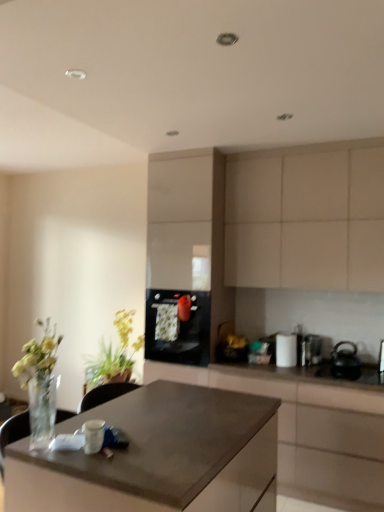
Where is `white glossy canister at upper right, which appears as the first appliance when viewed from the left`? This screenshot has height=512, width=384. white glossy canister at upper right, which appears as the first appliance when viewed from the left is located at coordinates (286, 350).

Locate an element on the screen. matte brown desk at center is located at coordinates (158, 456).

Image resolution: width=384 pixels, height=512 pixels. Describe the element at coordinates (115, 355) in the screenshot. I see `green leafy plant at left` at that location.

I want to click on white glossy canister at upper right, which is counted as the third appliance, starting from the right, so click(286, 350).

From the image's perspective, is matte brown desk at center above matte black countertop at center, the 2th cabinetry when ordered from top to bottom?

Yes, from the image's perspective, matte brown desk at center is on top of matte black countertop at center, the 2th cabinetry when ordered from top to bottom.

From the matte brown desk at center, count 1st cabinetry to the right and point to it. Please provide its 2D coordinates.

[(310, 429)]

Is matte brown desk at center oriented towards matte black countertop at center, the 2th cabinetry when ordered from top to bottom?

Yes.

From a real-world perspective, does matte brown desk at center stand above matte black countertop at center, the first cabinetry in the bottom-to-top sequence?

Yes, from a real-world perspective, matte brown desk at center is over matte black countertop at center, the first cabinetry in the bottom-to-top sequence

Is matte brown desk at center facing towards green leafy plant at left?

No, matte brown desk at center does not turn towards green leafy plant at left.

From the image's perspective, which one is positioned higher, matte brown desk at center or green leafy plant at left?

From the image's view, green leafy plant at left is above.

Is matte brown desk at center in front of or behind green leafy plant at left in the image?

Visually, matte brown desk at center is located in front of green leafy plant at left.

Is green leafy plant at left surrounded by matte brown desk at center?

Actually, green leafy plant at left is outside matte brown desk at center.

Relative to black glossy sink at lower right, is black glossy oven at center in front or behind?

In the image, black glossy oven at center appears behind black glossy sink at lower right.

Which is nearer, (x=169, y=346) or (x=332, y=374)?

Point (x=169, y=346) is farther from the camera than point (x=332, y=374).

Is black glossy oven at center located outside black glossy sink at lower right?

Yes, black glossy oven at center is located beyond the bounds of black glossy sink at lower right.

From a real-world perspective, is black glossy oven at center beneath black glossy sink at lower right?

No, from a real-world perspective, black glossy oven at center is not below black glossy sink at lower right.

Considering the sizes of objects satin silver toaster at right, which is the second appliance in right-to-left order, and black glossy oven at center in the image provided, who is thinner, satin silver toaster at right, which is the second appliance in right-to-left order, or black glossy oven at center?

With smaller width is satin silver toaster at right, which is the second appliance in right-to-left order.

I want to click on the 2nd appliance below the black glossy oven at center (from the image's perspective), so click(311, 350).

Is black glossy oven at center inside satin silver toaster at right, the second appliance positioned from the left?

No, black glossy oven at center is located outside of satin silver toaster at right, the second appliance positioned from the left.

Visually, is black glossy oven at center positioned to the left or to the right of satin silver toaster at right, the second appliance positioned from the left?

Clearly, black glossy oven at center is on the left of satin silver toaster at right, the second appliance positioned from the left, in the image.

Is black glossy oven at center oriented away from satin silver toaster at right, which is the second appliance in right-to-left order?

No.

Based on the photo, what's the angular difference between black glossy oven at center and satin silver toaster at right, which is the second appliance in right-to-left order,'s facing directions?

The angular difference between black glossy oven at center and satin silver toaster at right, which is the second appliance in right-to-left order, is 0.689 degrees.

From the image's perspective, is black glossy oven at center located beneath matte black countertop at center, the first cabinetry in the bottom-to-top sequence?

No, from the image's perspective, black glossy oven at center is not beneath matte black countertop at center, the first cabinetry in the bottom-to-top sequence.

From the picture: Is black glossy oven at center not inside matte black countertop at center, the first cabinetry in the bottom-to-top sequence?

black glossy oven at center is positioned outside matte black countertop at center, the first cabinetry in the bottom-to-top sequence.

In the image, is black glossy oven at center positioned in front of or behind matte black countertop at center, the 2th cabinetry when ordered from top to bottom?

Visually, black glossy oven at center is located behind matte black countertop at center, the 2th cabinetry when ordered from top to bottom.

Considering the sizes of objects black glossy oven at center and matte black countertop at center, the 2th cabinetry when ordered from top to bottom, in the image provided, who is thinner, black glossy oven at center or matte black countertop at center, the 2th cabinetry when ordered from top to bottom,?

With smaller width is black glossy oven at center.

Which is farther from the camera, (285, 450) or (119, 316)?

Point (119, 316)

How distant is matte black countertop at center, the 2th cabinetry when ordered from top to bottom, from green leafy plant at left?

They are 3.84 feet apart.

In the scene shown: Who is smaller, matte black countertop at center, the first cabinetry in the bottom-to-top sequence, or green leafy plant at left?

With smaller size is green leafy plant at left.

How different are the orientations of matte black countertop at center, the first cabinetry in the bottom-to-top sequence, and green leafy plant at left in degrees?

There is a 0.476-degree angle between the facing directions of matte black countertop at center, the first cabinetry in the bottom-to-top sequence, and green leafy plant at left.

Which cabinetry is the 1st one when counting from the back of the matte brown desk at center? Please provide its 2D coordinates.

[(310, 429)]

Locate an element on the screen. This screenshot has height=512, width=384. desk below the green leafy plant at left (from a real-world perspective) is located at coordinates (158, 456).

Estimate the real-world distances between objects in this image. Which object is closer to satin silver toaster at right, the second appliance positioned from the left, white glossy canister at upper right, which appears as the first appliance when viewed from the left, or black glossy sink at lower right?

white glossy canister at upper right, which appears as the first appliance when viewed from the left, lies closer to satin silver toaster at right, the second appliance positioned from the left, than the other object.

From the image, which object appears to be nearer to black matte kettle at right, the 3th appliance viewed from the left, satin silver toaster at right, the second appliance positioned from the left, or matte black countertop at center, the 2th cabinetry when ordered from top to bottom?

Based on the image, satin silver toaster at right, the second appliance positioned from the left, appears to be nearer to black matte kettle at right, the 3th appliance viewed from the left.

Which object lies further to the anchor point green leafy plant at left, black glossy sink at lower right or black glossy oven at center?

black glossy sink at lower right lies further to green leafy plant at left than the other object.

Which object lies nearer to the anchor point matte black countertop at center, the 2th cabinetry when ordered from top to bottom, satin silver toaster at right, which is the second appliance in right-to-left order, or green leafy plant at left?

Based on the image, satin silver toaster at right, which is the second appliance in right-to-left order, appears to be nearer to matte black countertop at center, the 2th cabinetry when ordered from top to bottom.

Considering their positions, is black matte kettle at right, which is the 1th appliance from right to left, positioned further to beige matte cabinet at upper right, which is the 1th cabinetry in top-to-bottom order, than matte black countertop at center, the first cabinetry in the bottom-to-top sequence?

matte black countertop at center, the first cabinetry in the bottom-to-top sequence, is further to beige matte cabinet at upper right, which is the 1th cabinetry in top-to-bottom order.

Estimate the real-world distances between objects in this image. Which object is further from black glossy sink at lower right, white glossy canister at upper right, which is counted as the third appliance, starting from the right, or matte black countertop at center, the 2th cabinetry when ordered from top to bottom?

The object further to black glossy sink at lower right is matte black countertop at center, the 2th cabinetry when ordered from top to bottom.

From the picture: Considering their positions, is green leafy plant at left positioned further to matte black countertop at center, the 2th cabinetry when ordered from top to bottom, than black glossy oven at center?

green leafy plant at left is positioned further to the anchor matte black countertop at center, the 2th cabinetry when ordered from top to bottom.

Considering their positions, is matte black countertop at center, the first cabinetry in the bottom-to-top sequence, positioned closer to satin silver toaster at right, which is the second appliance in right-to-left order, than black glossy oven at center?

matte black countertop at center, the first cabinetry in the bottom-to-top sequence, lies closer to satin silver toaster at right, which is the second appliance in right-to-left order, than the other object.

Where is `kitchen appliance between green leafy plant at left and black matte kettle at right, the 3th appliance viewed from the left, in the horizontal direction`? The height and width of the screenshot is (512, 384). kitchen appliance between green leafy plant at left and black matte kettle at right, the 3th appliance viewed from the left, in the horizontal direction is located at coordinates (177, 328).

Image resolution: width=384 pixels, height=512 pixels. What are the coordinates of `sink between green leafy plant at left and black matte kettle at right, which is the 1th appliance from right to left, in the horizontal direction` in the screenshot? It's located at (351, 366).

Identify the location of sink positioned between matte brown desk at center and satin silver toaster at right, which is the second appliance in right-to-left order, from near to far. (351, 366).

The height and width of the screenshot is (512, 384). I want to click on sink between matte brown desk at center and black glossy oven at center along the z-axis, so click(351, 366).